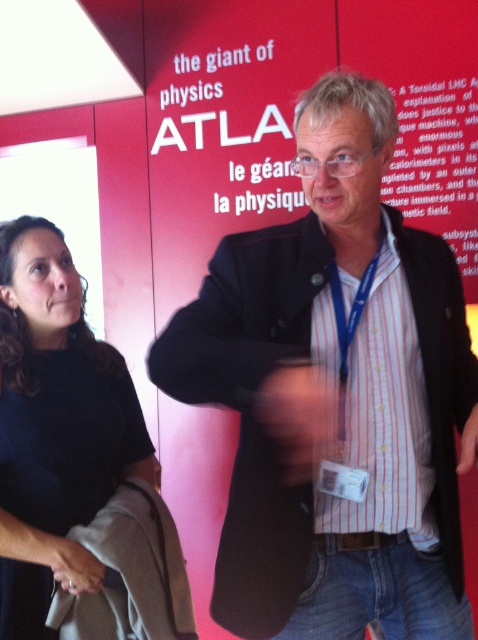
What is the position of the striped cotton shirt at center relative to the black matte shirt at upper left?

The striped cotton shirt at center is to the right of the black matte shirt at upper left.

You are a photographer setting up for a portrait. You notice the striped cotton shirt at center is exactly 37.58 inches away from the camera. If your focus range is set to 35 inches, will the shirt be in focus?

The striped cotton shirt at center is 37.58 inches away from the camera, which is slightly beyond the focus range of 35 inches. Therefore, the shirt may not be in focus.

You are standing in the conference room and want to determine which of the two points, point (259,419) or point (107,474), is closer to you. Based on the image, which point is nearer?

Point (259,419) is closer to the viewer than point (107,474).